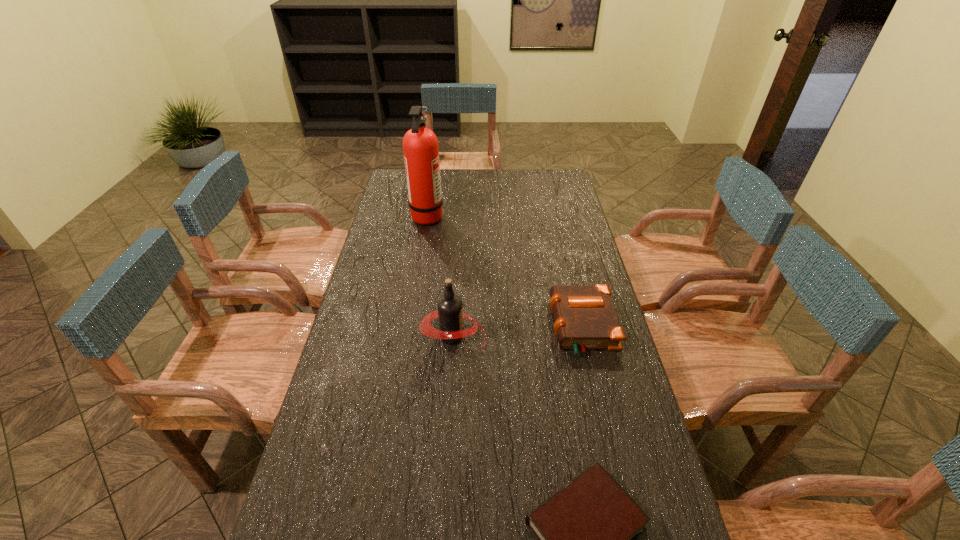
This screenshot has height=540, width=960. In order to click on the tallest object in this screenshot , I will do `click(420, 145)`.

What are the coordinates of `fire extinguisher` in the screenshot? It's located at 420,145.

You are a GUI agent. You are given a task and a screenshot of the screen. Output one action in this format:
    pyautogui.click(x=<x>, y=<y>)
    Task: Click on the root beer
    
    Given the screenshot: What is the action you would take?
    pyautogui.click(x=450, y=314)

You are a GUI agent. You are given a task and a screenshot of the screen. Output one action in this format:
    pyautogui.click(x=<x>, y=<y>)
    Task: Click on the farther Bible
    The image size is (960, 540).
    Given the screenshot: What is the action you would take?
    pyautogui.click(x=585, y=318)

The image size is (960, 540). In order to click on vacant area situated on the handle side of the farthest object in this screenshot , I will do `click(510, 216)`.

The height and width of the screenshot is (540, 960). I want to click on free space located 0.340m on the label of the root beer, so click(x=591, y=336).

This screenshot has width=960, height=540. Find the location of `free spot located 0.340m on the spine side of the farther Bible`. free spot located 0.340m on the spine side of the farther Bible is located at coordinates (447, 326).

This screenshot has width=960, height=540. What are the coordinates of `vacant space located 0.270m on the spine side of the farther Bible` in the screenshot? It's located at (468, 326).

Where is `free spot located on the spine side of the farther Bible`? free spot located on the spine side of the farther Bible is located at coordinates (468, 326).

Find the location of a particular element. The width and height of the screenshot is (960, 540). object at the left edge is located at coordinates (420, 145).